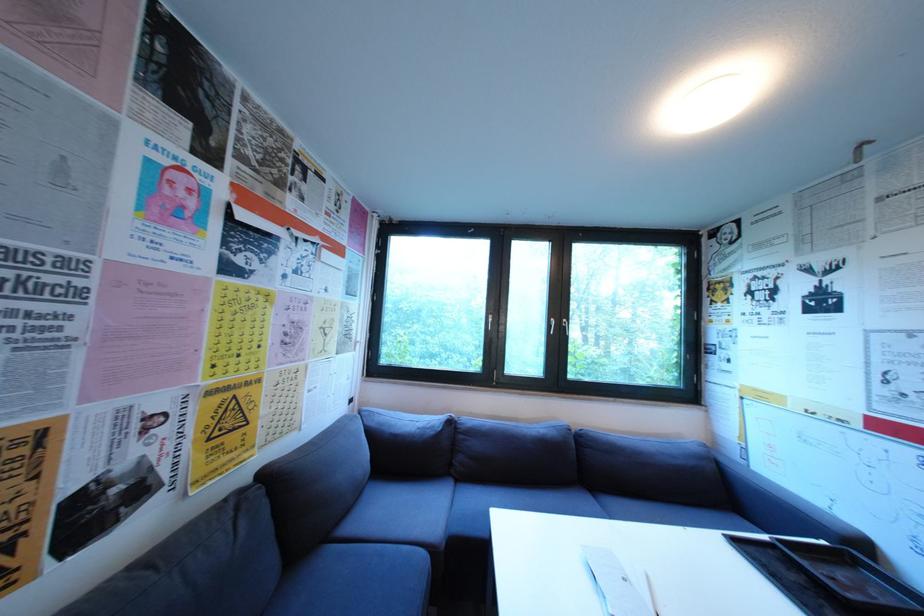
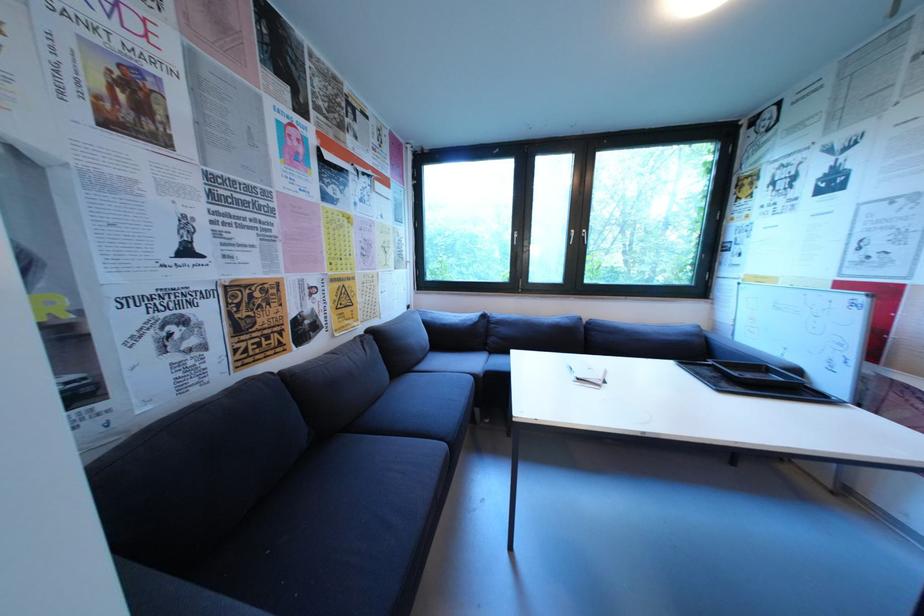
Locate, in the second image, the point that corresponds to [760,552] in the first image.

(699, 369)